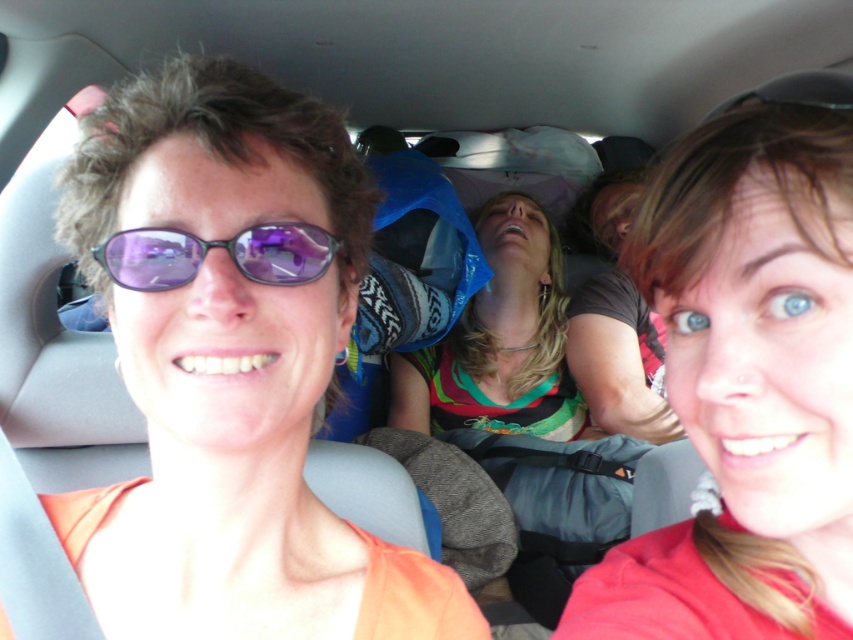
Can you confirm if smooth red shirt at center is wider than multicolored jersey at center?

In fact, smooth red shirt at center might be narrower than multicolored jersey at center.

Find the location of `smooth red shirt at center`. smooth red shirt at center is located at coordinates (747, 384).

Does point (704, 579) come in front of point (529, 342)?

Yes, point (704, 579) is closer to viewer.

Locate an element on the screen. Image resolution: width=853 pixels, height=640 pixels. smooth red shirt at center is located at coordinates (747, 384).

Which of these two, smooth red shirt at center or purple reflective sunglasses at center, stands taller?

smooth red shirt at center

Does smooth red shirt at center have a lesser height compared to purple reflective sunglasses at center?

No.

At what (x,y) coordinates should I click in order to perform the action: click on smooth red shirt at center. Please return your answer as a coordinate pair (x, y). Looking at the image, I should click on (747, 384).

Who is more distant from viewer, (556, 324) or (270, 236)?

The point (556, 324) is behind.

Which is below, multicolored jersey at center or purple reflective sunglasses at center?

multicolored jersey at center

Image resolution: width=853 pixels, height=640 pixels. What do you see at coordinates (498, 340) in the screenshot? I see `multicolored jersey at center` at bounding box center [498, 340].

What are the coordinates of `multicolored jersey at center` in the screenshot? It's located at (498, 340).